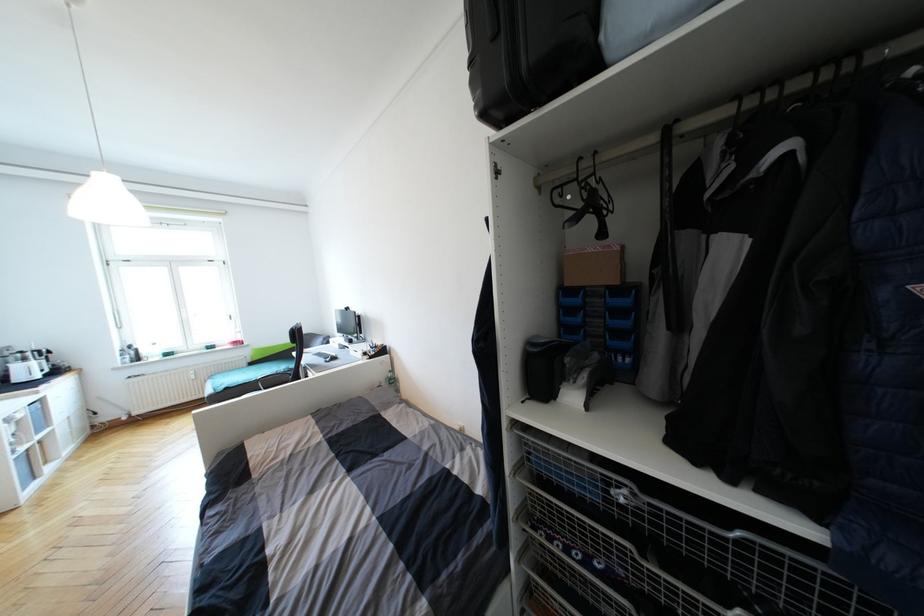
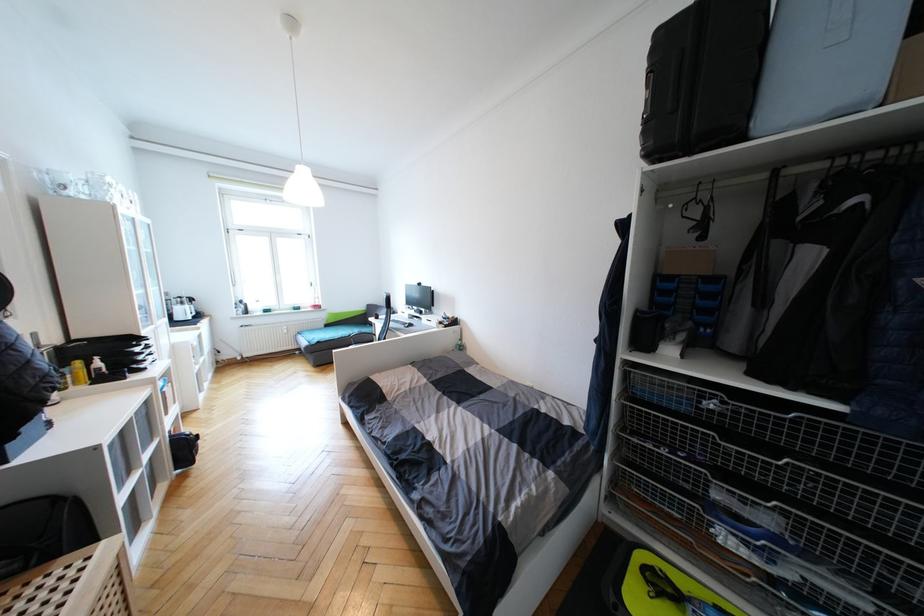
The point at (x=613, y=55) is marked in the first image. Where is the corresponding point in the second image?

(757, 134)